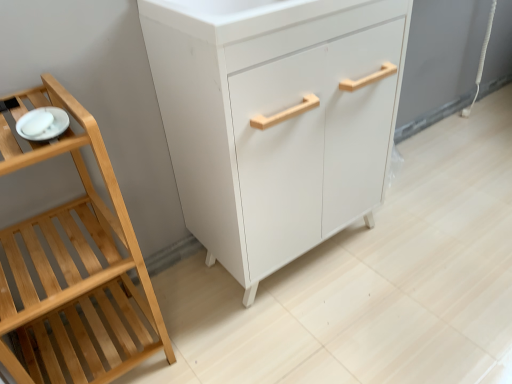
Where is `white glossy plate at left`? white glossy plate at left is located at coordinates (42, 124).

Where is `white glossy plate at left`? white glossy plate at left is located at coordinates (42, 124).

Can you tell me how much white matte cabinet at center and white glossy plate at left differ in facing direction?

1.23 degrees separate the facing orientations of white matte cabinet at center and white glossy plate at left.

Which is more to the left, white matte cabinet at center or white glossy plate at left?

white glossy plate at left.

Which is in front, point (212, 140) or point (25, 136)?

Point (25, 136)

Is white matte cabinet at center looking in the opposite direction of white glossy plate at left?

white matte cabinet at center is not turned away from white glossy plate at left.

Which is closer to the camera, (200, 84) or (60, 137)?

Point (200, 84) is positioned farther from the camera compared to point (60, 137).

From a real-world perspective, who is located lower, white matte cabinet at center or natural wood shelf at left?

In real-world perspective, natural wood shelf at left is lower.

The image size is (512, 384). In the image, there is a white matte cabinet at center. Identify the location of furniture below it (from the image's perspective). (73, 262).

Is white matte cabinet at center positioned with its back to natural wood shelf at left?

No, white matte cabinet at center is not facing away from natural wood shelf at left.

Is white glossy plate at left smaller than white matte cabinet at center?

Correct, white glossy plate at left occupies less space than white matte cabinet at center.

From the image's perspective, is white glossy plate at left on white matte cabinet at center?

No, from the image's perspective, white glossy plate at left is not over white matte cabinet at center.

Between point (113, 350) and point (56, 119), which one is positioned behind?

The point (113, 350) is farther.

Which of these two, natural wood shelf at left or white glossy plate at left, is bigger?

natural wood shelf at left.

From their relative heights in the image, would you say natural wood shelf at left is taller or shorter than white glossy plate at left?

In the image, natural wood shelf at left appears to be taller than white glossy plate at left.

How many degrees apart are the facing directions of natural wood shelf at left and white glossy plate at left?

There is a 0.466-degree angle between the facing directions of natural wood shelf at left and white glossy plate at left.

In terms of width, does natural wood shelf at left look wider or thinner when compared to white matte cabinet at center?

Considering their sizes, natural wood shelf at left looks slimmer than white matte cabinet at center.

Is natural wood shelf at left closer to camera compared to white matte cabinet at center?

That is True.

Is natural wood shelf at left at the left side of white matte cabinet at center?

Correct, you'll find natural wood shelf at left to the left of white matte cabinet at center.

Considering the sizes of objects white glossy plate at left and natural wood shelf at left in the image provided, who is thinner, white glossy plate at left or natural wood shelf at left?

white glossy plate at left.

From their relative heights in the image, would you say white glossy plate at left is taller or shorter than natural wood shelf at left?

Clearly, white glossy plate at left is shorter compared to natural wood shelf at left.

From the image's perspective, would you say white glossy plate at left is positioned over natural wood shelf at left?

Yes, from the image's perspective, white glossy plate at left is over natural wood shelf at left.

From a real-world perspective, between white glossy plate at left and natural wood shelf at left, who is vertically lower?

In real-world perspective, natural wood shelf at left is lower.

Identify the location of tableware in front of the white matte cabinet at center. pyautogui.click(x=42, y=124).

You are a GUI agent. You are given a task and a screenshot of the screen. Output one action in this format:
    pyautogui.click(x=<x>, y=<y>)
    Task: Click on the chest of drawers above the natural wood shelf at left (from a real-world perspective)
    The width and height of the screenshot is (512, 384).
    Given the screenshot: What is the action you would take?
    pyautogui.click(x=276, y=119)

Based on their spatial positions, is natural wood shelf at left or white matte cabinet at center further from white glossy plate at left?

white matte cabinet at center.

Considering their positions, is white glossy plate at left positioned further to natural wood shelf at left than white matte cabinet at center?

Based on the image, white matte cabinet at center appears to be further to natural wood shelf at left.

Which object lies further to the anchor point white matte cabinet at center, white glossy plate at left or natural wood shelf at left?

white glossy plate at left is further to white matte cabinet at center.

From the image, which object appears to be nearer to white glossy plate at left, white matte cabinet at center or natural wood shelf at left?

natural wood shelf at left lies closer to white glossy plate at left than the other object.

When comparing their distances from white matte cabinet at center, does natural wood shelf at left or white glossy plate at left seem closer?

natural wood shelf at left lies closer to white matte cabinet at center than the other object.

From the image, which object appears to be farther from natural wood shelf at left, white matte cabinet at center or white glossy plate at left?

white matte cabinet at center is further to natural wood shelf at left.

Identify the location of tableware situated between natural wood shelf at left and white matte cabinet at center from left to right. (42, 124).